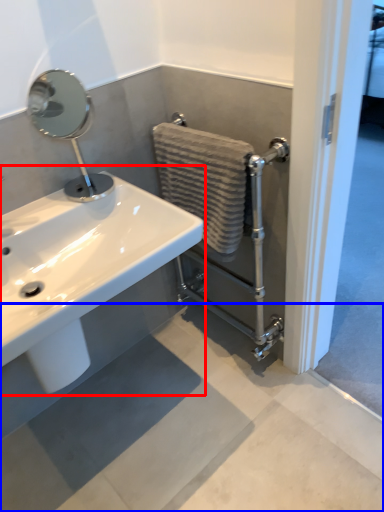
Question: Which object is further to the camera taking this photo, sink (highlighted by a red box) or concrete (highlighted by a blue box)?

Choices:
 (A) sink
 (B) concrete

Answer: (B)